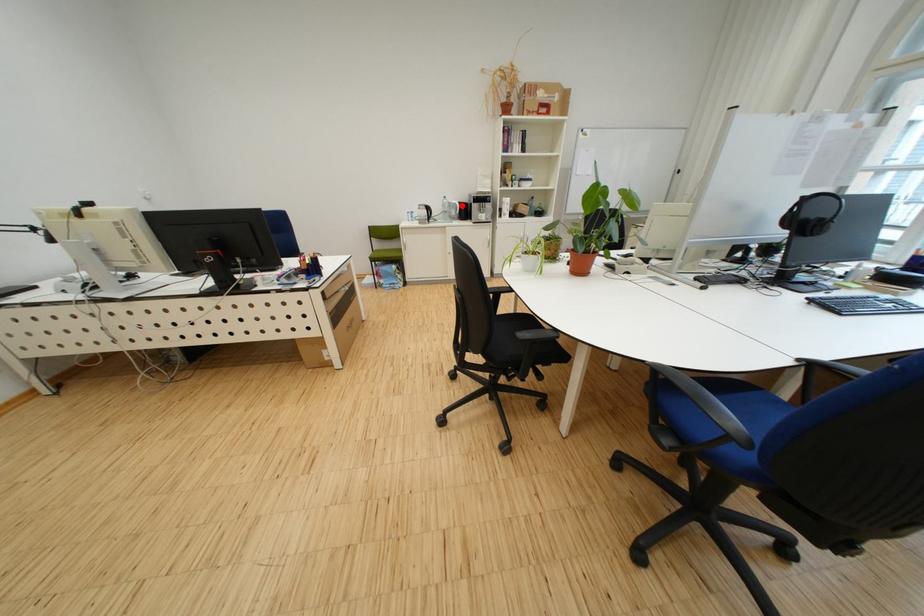
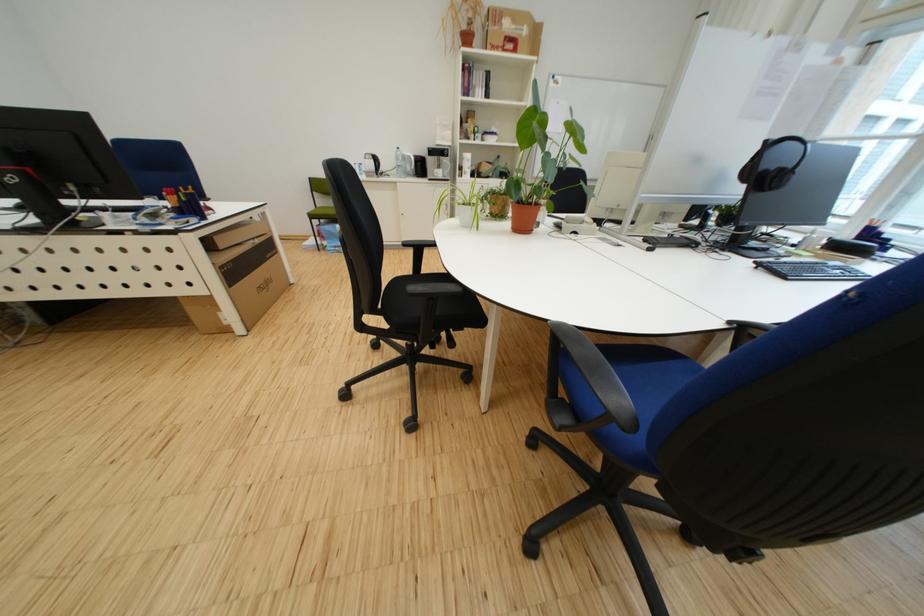
In the second image, find the point that corresponds to the highlighted location in the first image.

(417, 159)